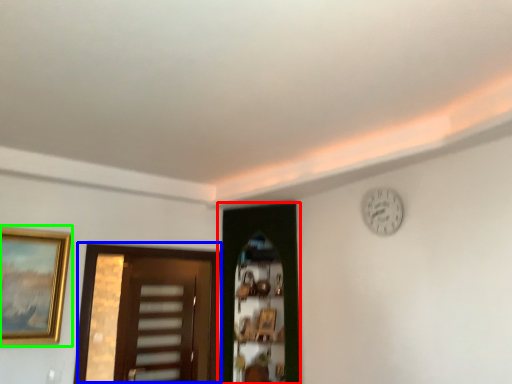
Question: Which is nearer to the door (highlighted by a red box)? door (highlighted by a blue box) or picture frame (highlighted by a green box).

Choices:
 (A) door
 (B) picture frame

Answer: (B)